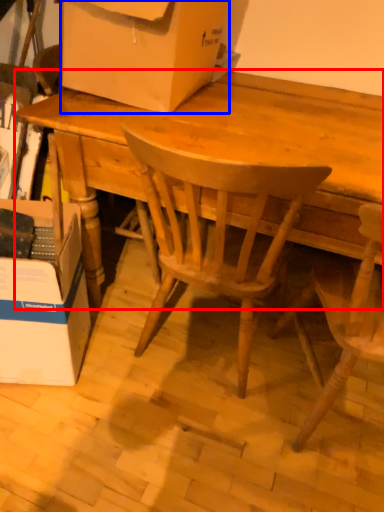
Question: Which point is further to the camera, desk (highlighted by a red box) or box (highlighted by a blue box)?

Choices:
 (A) desk
 (B) box

Answer: (B)